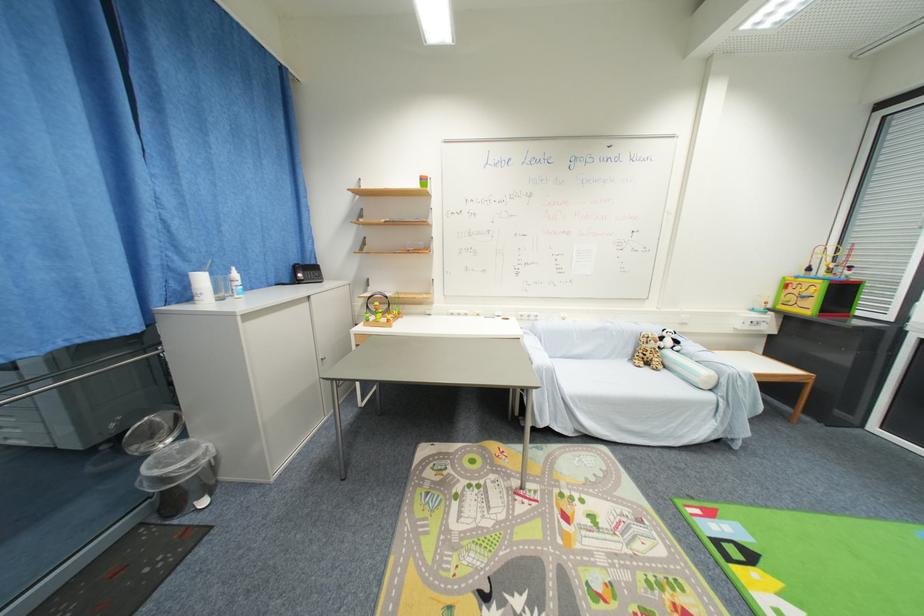
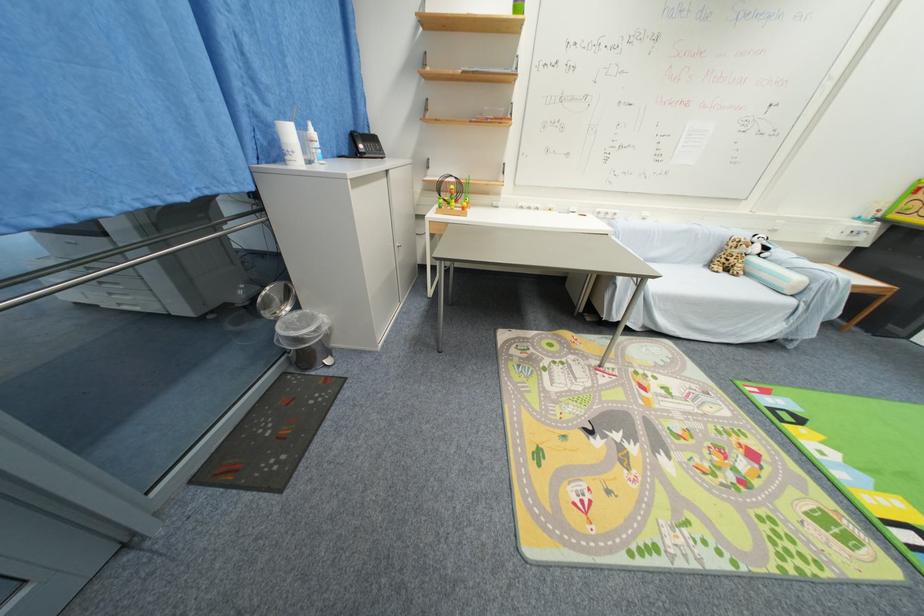
Find the pixel in the second image that matches [651,371] in the first image.

(730, 276)